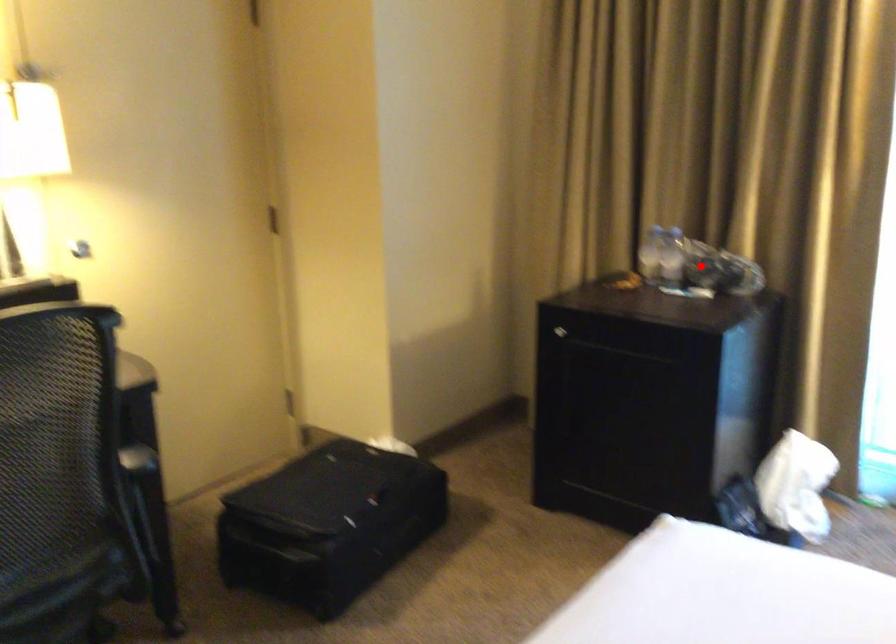
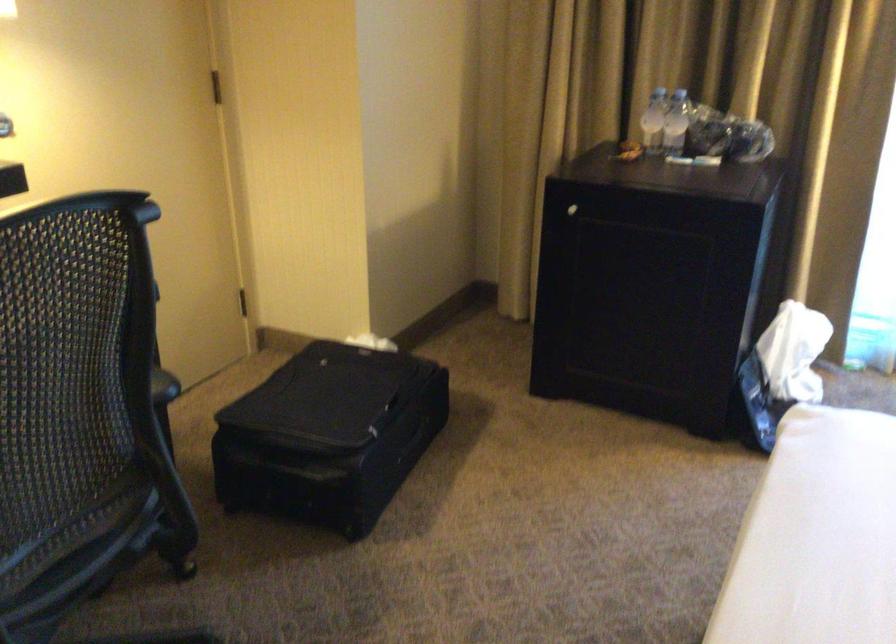
In the second image, find the point that corresponds to the highlighted location in the first image.

(708, 131)